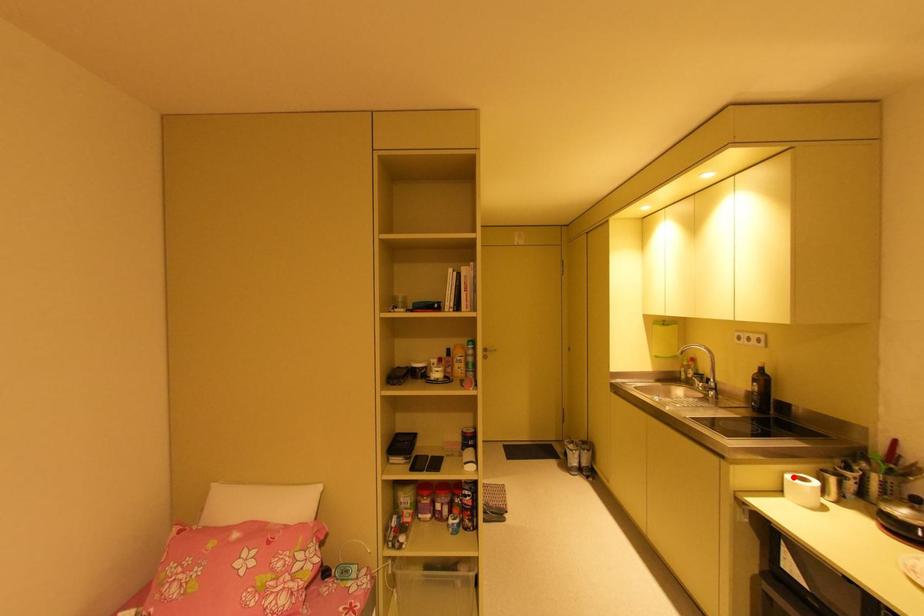
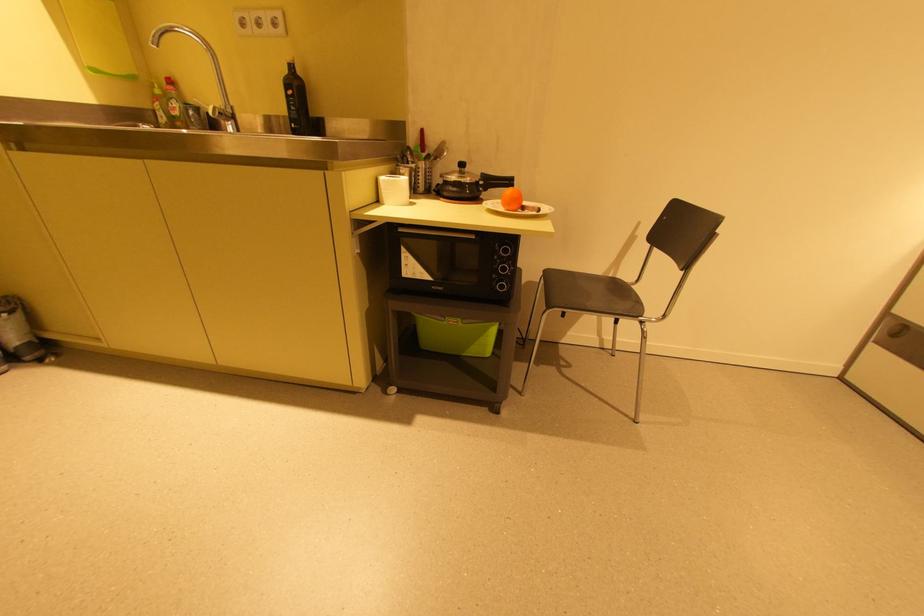
The point at the highlighted location is marked in the first image. Where is the corresponding point in the second image?

(387, 179)